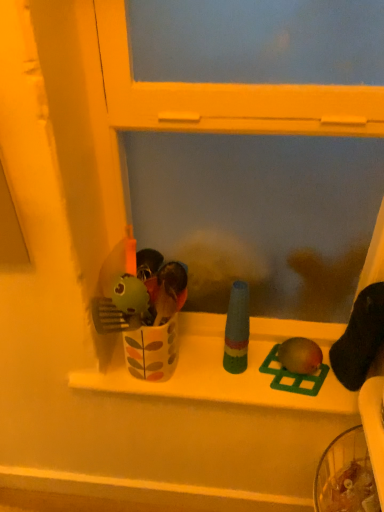
Where is `vacant space situated on the left part of green plastic bird at center, which is counted as the 2th toy, starting from the right`? vacant space situated on the left part of green plastic bird at center, which is counted as the 2th toy, starting from the right is located at coordinates (226, 373).